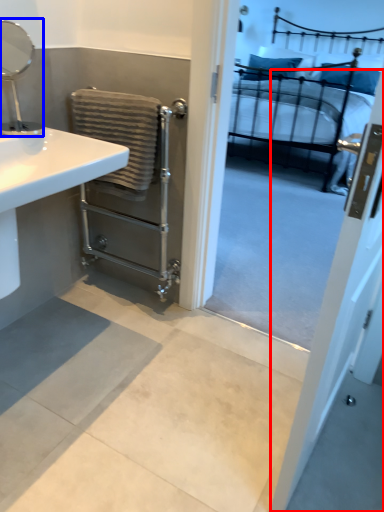
Question: Which object is further to the camera taking this photo, screen door (highlighted by a red box) or mirror (highlighted by a blue box)?

Choices:
 (A) screen door
 (B) mirror

Answer: (B)